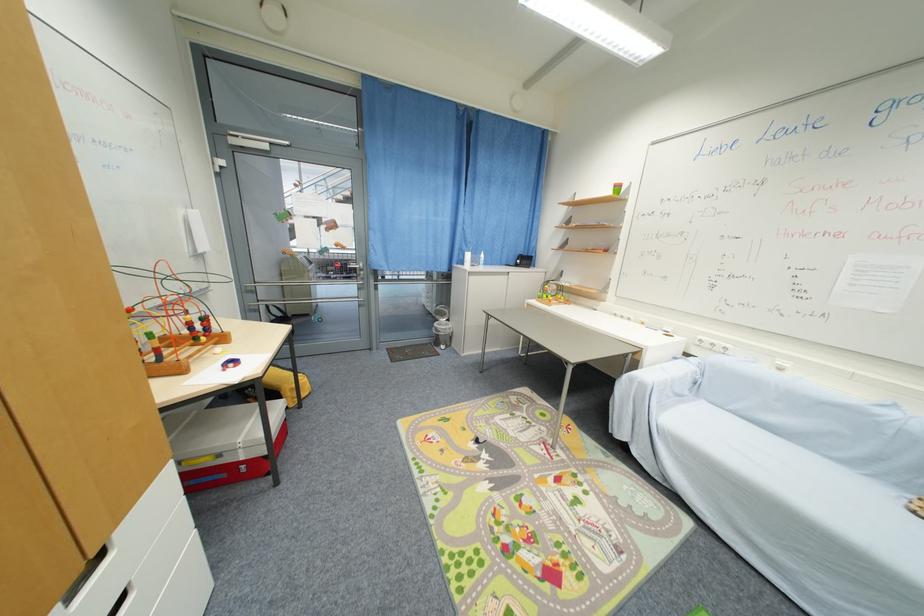
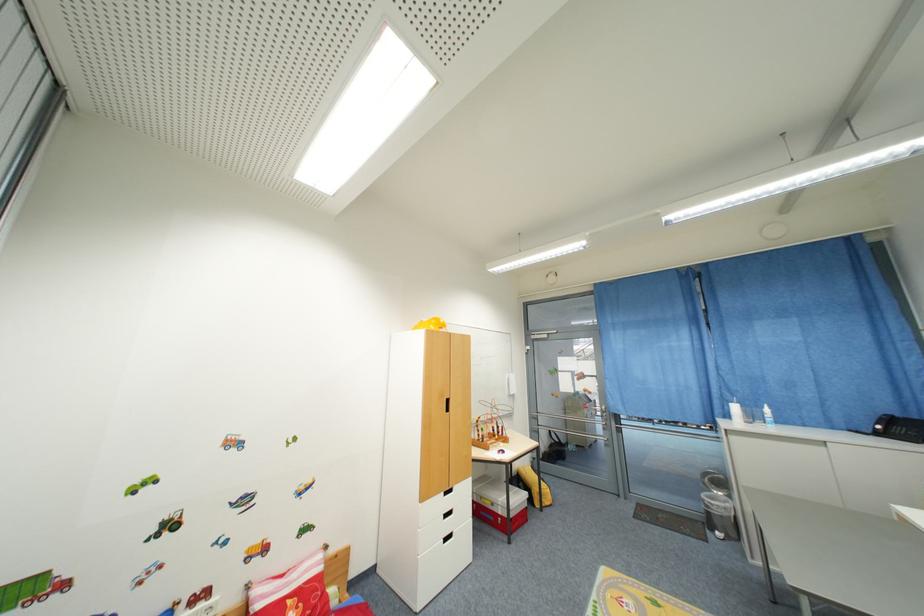
Locate, in the second image, the point that corresponds to the point at 201,341 in the first image.

(500, 438)